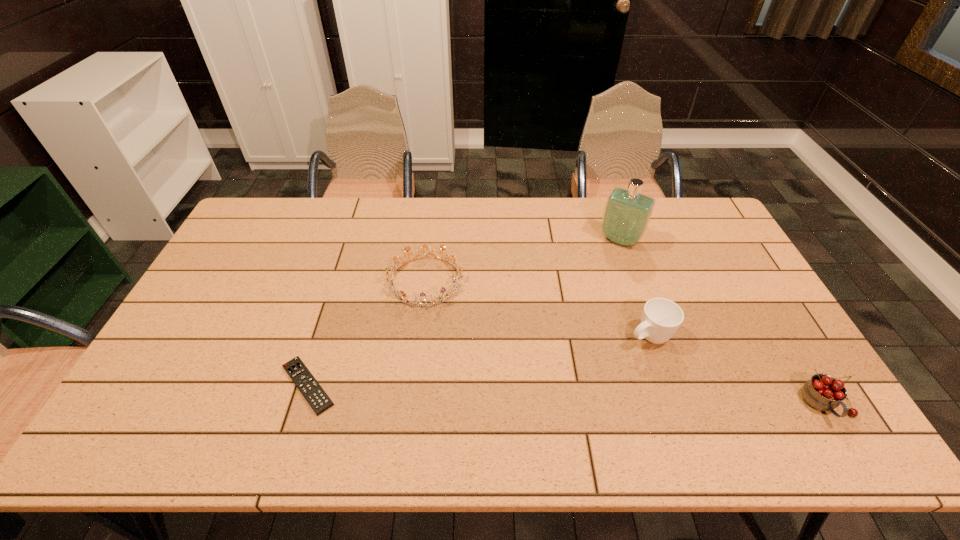
Where is `free spot on the desktop that is between the leftmost object and the pot filled with cherries and is positioned on the front label of the farthest object`? This screenshot has height=540, width=960. free spot on the desktop that is between the leftmost object and the pot filled with cherries and is positioned on the front label of the farthest object is located at coordinates (524, 393).

Where is `vacant space on the desktop that is between the leftmost object and the pot filled with cherries and is positioned on the front-facing side of the second shortest object`? vacant space on the desktop that is between the leftmost object and the pot filled with cherries and is positioned on the front-facing side of the second shortest object is located at coordinates (516, 393).

In order to click on free space on the desktop that is between the leftmost object and the rightmost object and is positioned with the handle on the side of the third nearest object in this screenshot , I will do `click(549, 394)`.